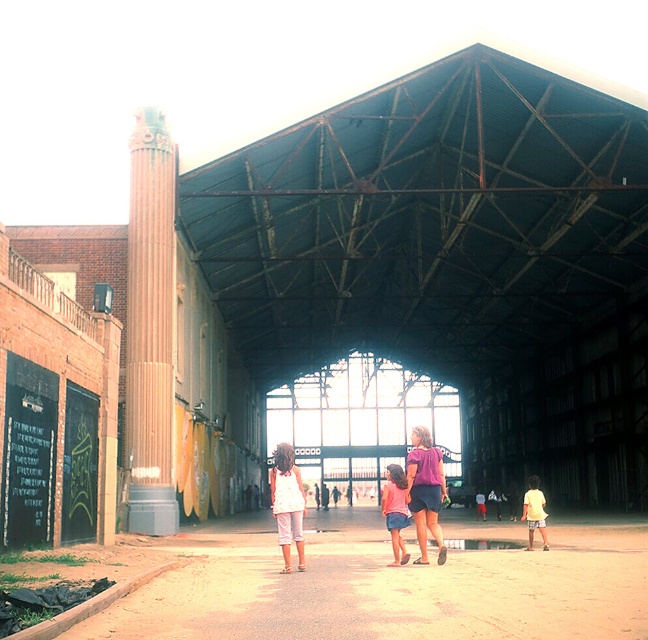
Question: Which point is closer to the camera?

Choices:
 (A) (284, 483)
 (B) (146, 467)
 (C) (540, 516)

Answer: (A)

Question: Among these points, which one is nearest to the camera?

Choices:
 (A) (14, 412)
 (B) (419, 561)

Answer: (A)

Question: Can you confirm if black chalkboard at left is positioned to the left of denim shorts at center?

Choices:
 (A) yes
 (B) no

Answer: (A)

Question: Does rustic stone column at left appear under white cotton shorts at center?

Choices:
 (A) no
 (B) yes

Answer: (A)

Question: Which object is the closest to the white cotton shorts at center?

Choices:
 (A) purple fabric shirt at center
 (B) denim shorts at center

Answer: (A)

Question: Observing the image, what is the correct spatial positioning of black chalkboard at left in reference to purple fabric shirt at center?

Choices:
 (A) below
 (B) above

Answer: (B)